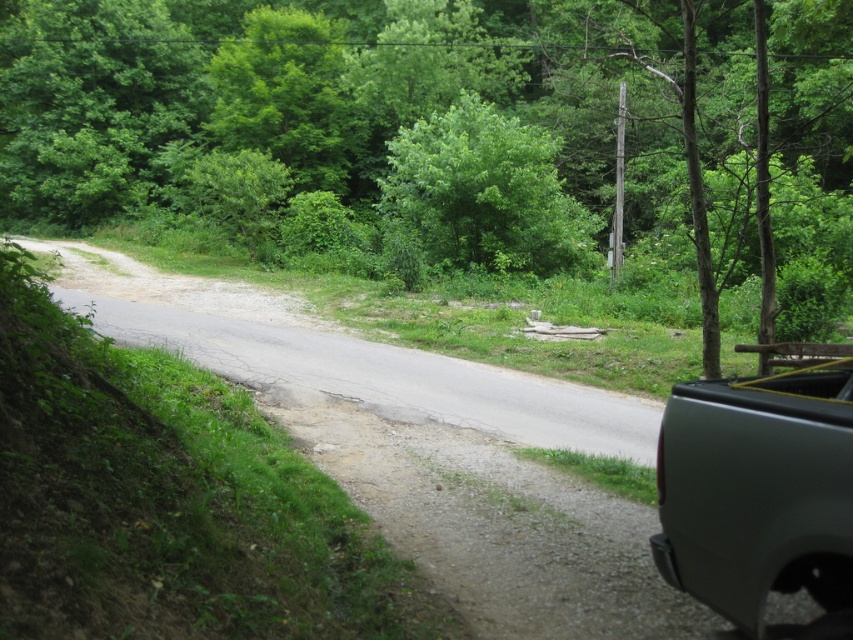
You are standing at the point marked as point (430, 109) in the image, which is in a rural forest area. You want to walk towards the pickup truck parked on the right side of the road. Which direction should you head to reach the pickup truck?

The point (430, 109) corresponds to the green leafy tree at upper center. To reach the pickup truck parked on the right side of the road, you should head downwards from the green leafy tree at upper center towards the lower right direction.

You are a hiker who wants to take a photo of the satin gray truck at right without the green leafy tree at upper center blocking the view. What should you do?

The green leafy tree at upper center is larger in size than the satin gray truck at right, so you should move to a position where the tree is not between you and the truck, perhaps by going around to the side or behind the truck to avoid the tree blocking the view.